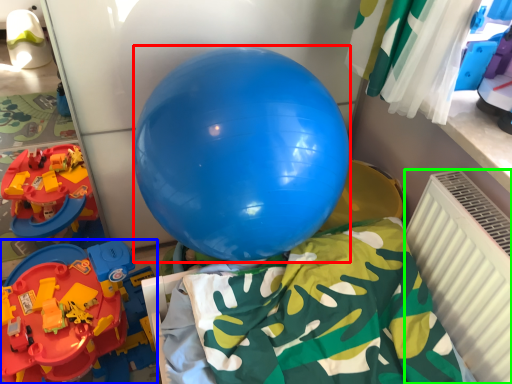
Question: Which object is the farthest from balloon (highlighted by a red box)? Choose among these: toy (highlighted by a blue box) or radiator (highlighted by a green box).

Choices:
 (A) toy
 (B) radiator

Answer: (A)